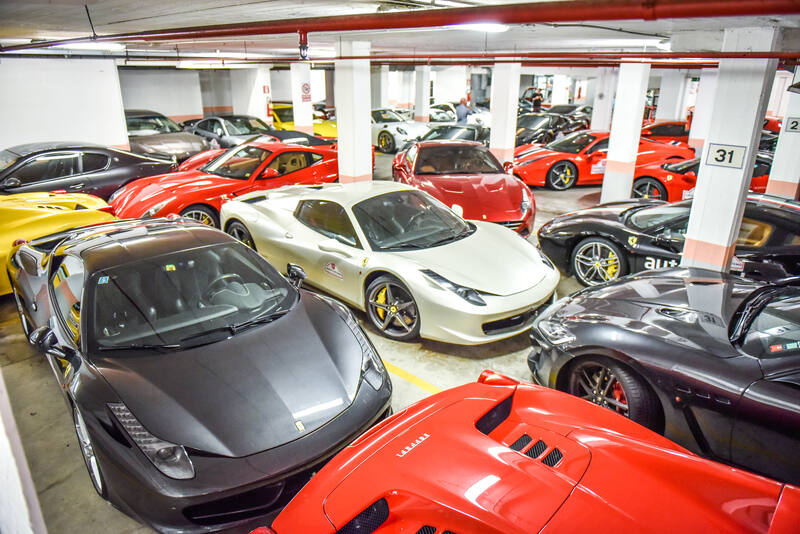
Image resolution: width=800 pixels, height=534 pixels. I want to click on ceiling, so click(x=568, y=36).